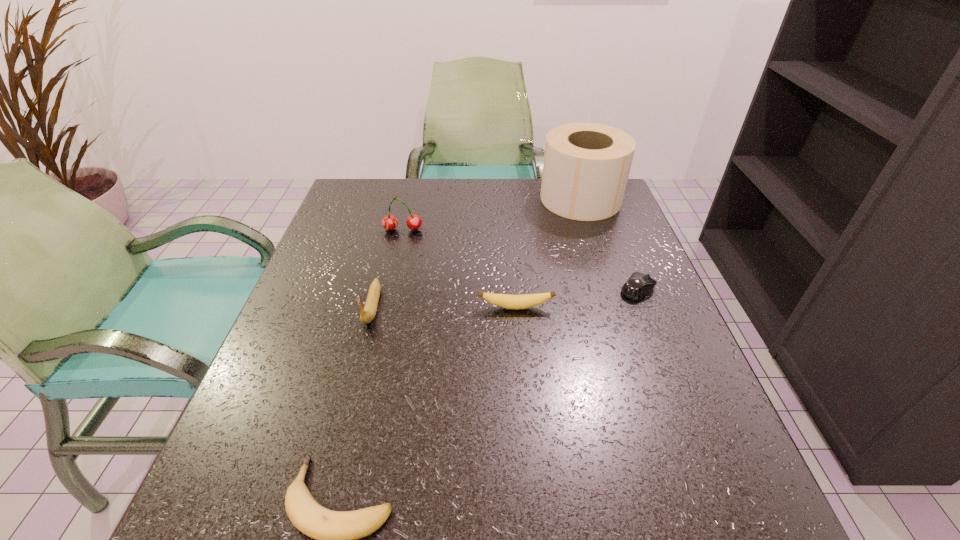
Image resolution: width=960 pixels, height=540 pixels. I want to click on vacant area located on the back of the second tallest banana, so click(508, 218).

Where is `vacant space situated 0.080m on the left of the mouse`? vacant space situated 0.080m on the left of the mouse is located at coordinates (584, 289).

Find the location of a particular element. The image size is (960, 540). object situated at the far edge is located at coordinates (586, 166).

Locate an element on the screen. cherry that is at the left edge is located at coordinates (389, 222).

You are a GUI agent. You are given a task and a screenshot of the screen. Output one action in this format:
    pyautogui.click(x=<x>, y=<y>)
    Task: Click on the banana that is at the left edge
    The height and width of the screenshot is (540, 960).
    Given the screenshot: What is the action you would take?
    pyautogui.click(x=368, y=313)

Where is `toilet tissue present at the right edge`? toilet tissue present at the right edge is located at coordinates (586, 166).

Locate an element on the screen. The image size is (960, 540). mouse located in the right edge section of the desktop is located at coordinates (639, 285).

Where is `object that is at the far right corner`? The image size is (960, 540). object that is at the far right corner is located at coordinates (586, 166).

In the image, there is a desktop. Where is `vacant region at the far edge`? This screenshot has width=960, height=540. vacant region at the far edge is located at coordinates (496, 181).

Find the location of a particular element. vacant point at the near edge is located at coordinates (329, 496).